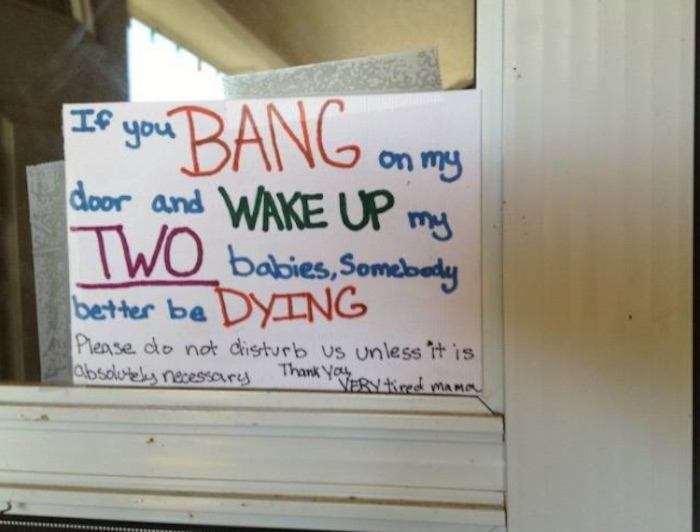
Find the location of a particular element. The width and height of the screenshot is (700, 532). frame is located at coordinates (542, 295).